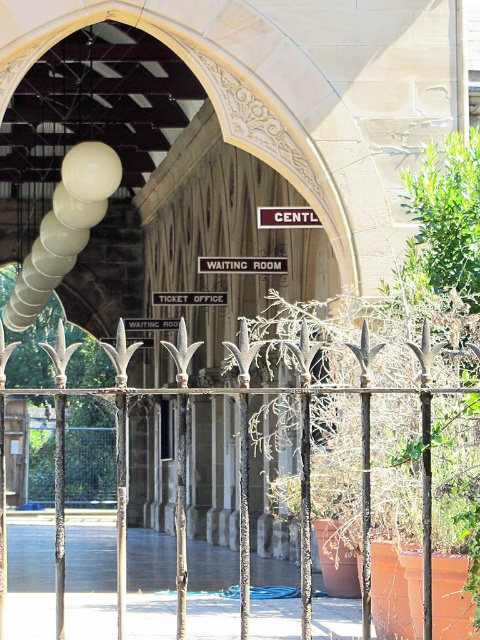
Identify the location of rusty iron fence at center. The image size is (480, 640). (91, 566).

Can you confirm if rusty iron fence at center is positioned above black metal sign at center?

No.

Identify the location of rusty iron fence at center. (91, 566).

In order to click on rusty iron fence at center in this screenshot , I will do `click(91, 566)`.

Does black metal sign at center have a lesser width compared to black plastic ticket office at center?

Yes, black metal sign at center is thinner than black plastic ticket office at center.

Locate an element on the screen. The height and width of the screenshot is (640, 480). black metal sign at center is located at coordinates (241, 264).

Where is `black metal sign at center`? This screenshot has width=480, height=640. black metal sign at center is located at coordinates (241, 264).

Between black plastic ticket office at center and white plastic sign at center, which one has less height?

white plastic sign at center

Can you confirm if black plastic ticket office at center is positioned to the right of white plastic sign at center?

Yes, black plastic ticket office at center is to the right of white plastic sign at center.

The width and height of the screenshot is (480, 640). Identify the location of black plastic ticket office at center. (189, 298).

Identify the location of black plastic ticket office at center. The height and width of the screenshot is (640, 480). (189, 298).